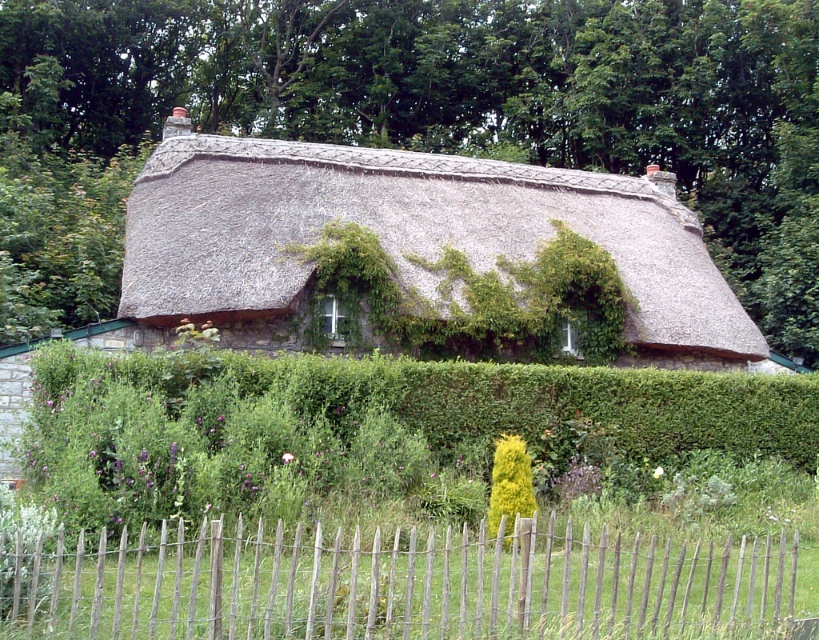
Question: Can you confirm if thatched roof cottage at center is positioned to the right of wooden picket fence at lower center?

Choices:
 (A) yes
 (B) no

Answer: (B)

Question: Can you confirm if green leafy hedge at center is positioned above thatched roof cottage at center?

Choices:
 (A) no
 (B) yes

Answer: (A)

Question: Which of the following is the farthest from the observer?

Choices:
 (A) (259, 321)
 (B) (48, 499)
 (C) (423, 609)

Answer: (A)

Question: Which point is closer to the camera?

Choices:
 (A) (469, 534)
 (B) (405, 221)
 (C) (810, 440)

Answer: (A)

Question: Which of the following is the closest to the observer?

Choices:
 (A) (238, 292)
 (B) (284, 611)

Answer: (B)

Question: Can you confirm if green leafy hedge at center is positioned to the left of thatched roof cottage at center?

Choices:
 (A) no
 (B) yes

Answer: (A)